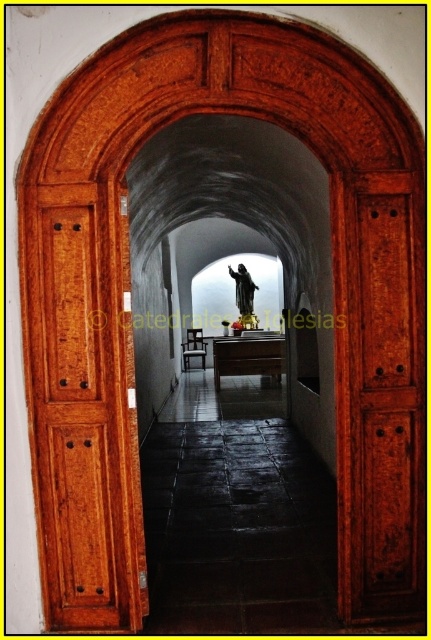
You are an interior designer assessing the proportions of a chapel. You need to ensure that all doorways are at least twice the height of any statues placed in front of them. Given the wooden panelled door at left and the black polished statue at center, does the door meet this requirement?

The wooden panelled door at left is much taller than the black polished statue at center, so it meets the requirement of being at least twice the height.

You are standing in the corridor inside the wooden arched doorway. You see two points marked on the floor, one at point (121, 410) and the other at point (252, 282). Which point is closer to you as you face the chapel space beyond the doorway?

Point (121, 410) is in front of point (252, 282), so it is closer to you as you face the chapel space beyond the doorway.